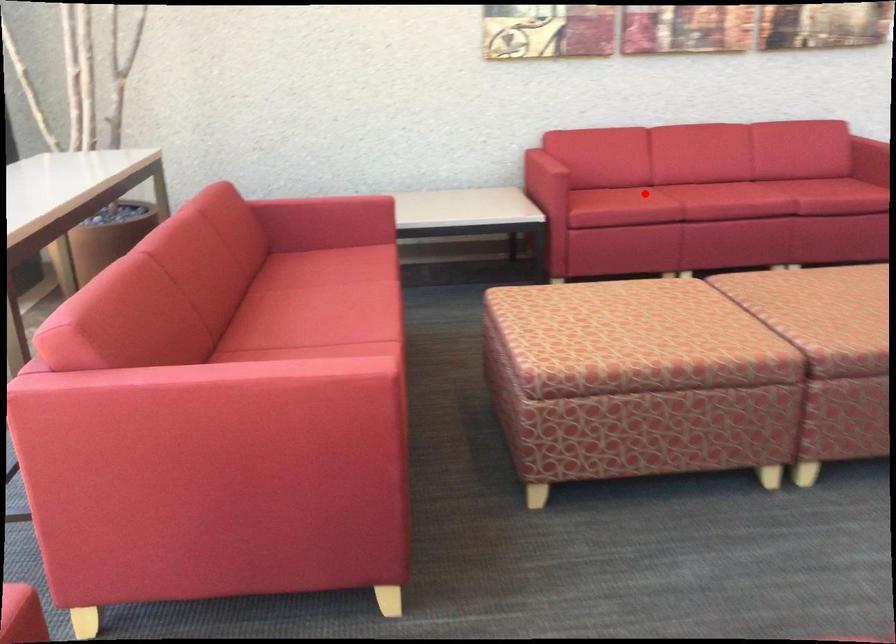
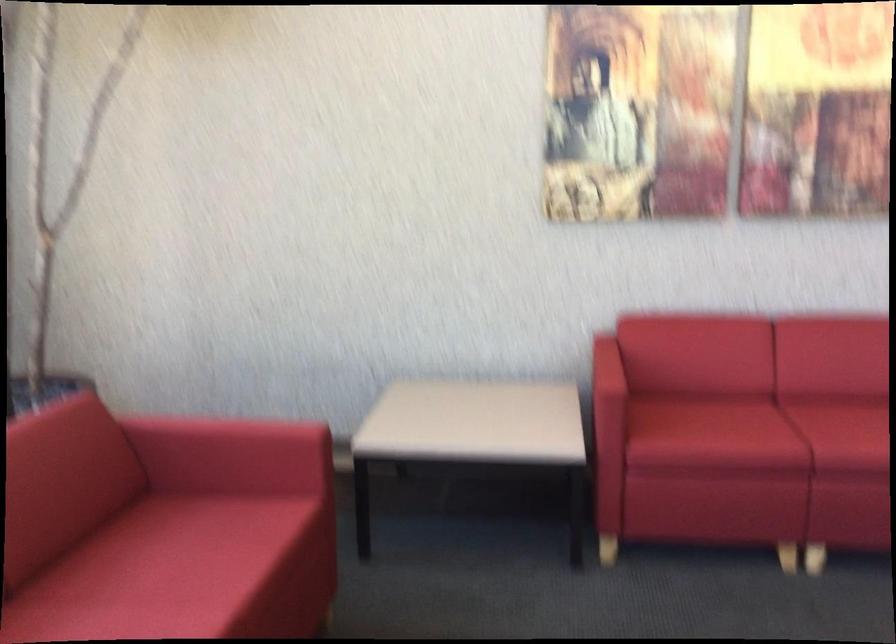
The point at the highlighted location is marked in the first image. Where is the corresponding point in the second image?

(757, 431)